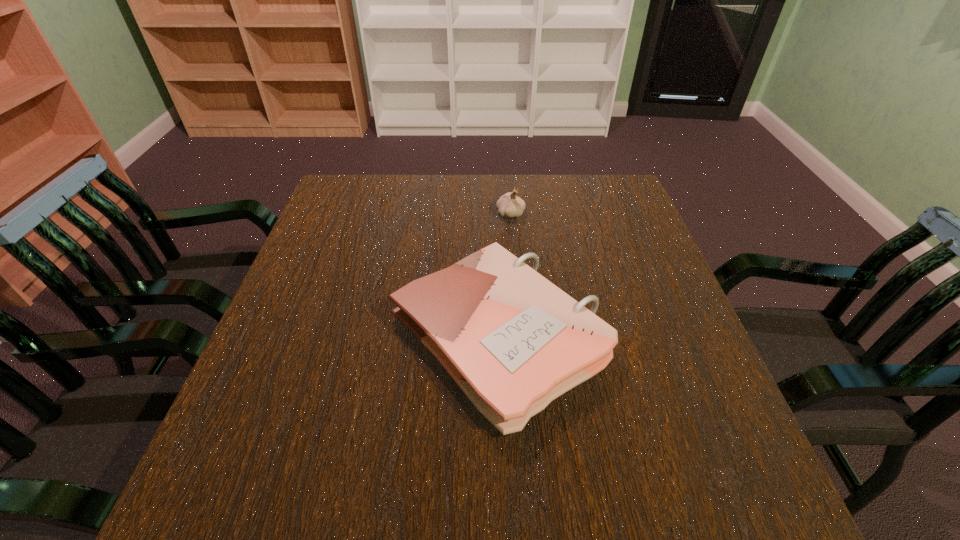
This screenshot has height=540, width=960. I want to click on the farther object, so click(x=509, y=205).

At what (x,y) coordinates should I click in order to perform the action: click on the nearer object. Please return your answer as a coordinate pair (x, y). The width and height of the screenshot is (960, 540). Looking at the image, I should click on (513, 341).

At what (x,y) coordinates should I click in order to perform the action: click on vacant space located on the left of the garlic. Please return your answer as a coordinate pair (x, y). The height and width of the screenshot is (540, 960). Looking at the image, I should click on (468, 214).

At what (x,y) coordinates should I click in order to perform the action: click on vacant space situated on the back of the nearer object. Please return your answer as a coordinate pair (x, y). The image size is (960, 540). Looking at the image, I should click on (492, 212).

This screenshot has width=960, height=540. I want to click on object that is at the far edge, so click(509, 205).

Identify the location of vacant space at the far edge of the desktop. This screenshot has height=540, width=960. (561, 211).

Find the location of `vacant space at the near edge of the desktop`. vacant space at the near edge of the desktop is located at coordinates (518, 519).

I want to click on free point at the left edge, so click(x=313, y=237).

What are the coordinates of `vacant space at the right edge of the desktop` in the screenshot? It's located at (726, 442).

In the image, there is a desktop. Identify the location of vacant area at the far left corner. The height and width of the screenshot is (540, 960). (371, 177).